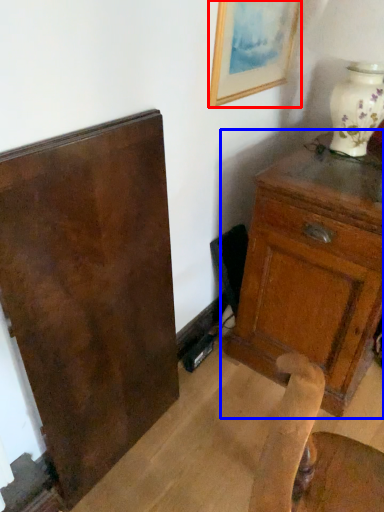
Question: Which object is closer to the camera taking this photo, picture frame (highlighted by a red box) or chest of drawers (highlighted by a blue box)?

Choices:
 (A) picture frame
 (B) chest of drawers

Answer: (B)